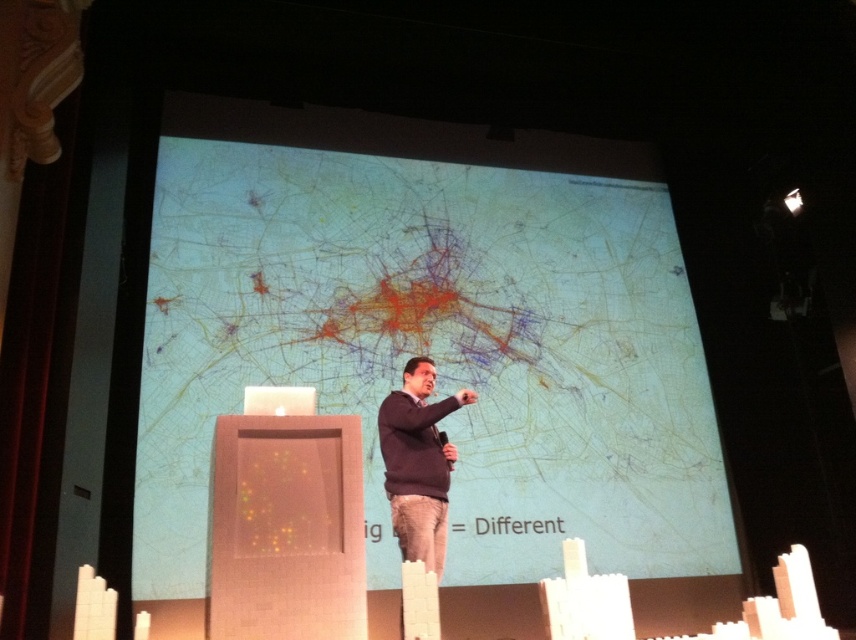
Question: Does matte plastic projection screen at center appear on the right side of dark blue sweater at center?

Choices:
 (A) yes
 (B) no

Answer: (A)

Question: Does matte plastic projection screen at center appear on the right side of dark blue sweater at center?

Choices:
 (A) no
 (B) yes

Answer: (B)

Question: Which object appears farthest from the camera in this image?

Choices:
 (A) matte plastic projection screen at center
 (B) dark blue sweater at center

Answer: (A)

Question: Among these points, which one is nearest to the camera?

Choices:
 (A) (437, 538)
 (B) (257, 220)

Answer: (A)

Question: Which point appears closest to the camera in this image?

Choices:
 (A) (536, 580)
 (B) (443, 406)

Answer: (B)

Question: Is matte plastic projection screen at center positioned behind dark blue sweater at center?

Choices:
 (A) no
 (B) yes

Answer: (B)